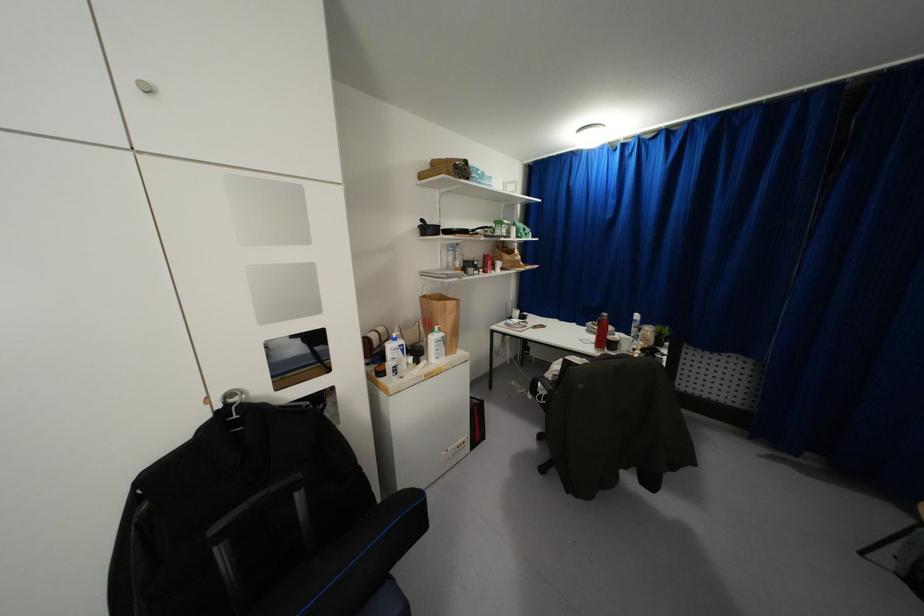
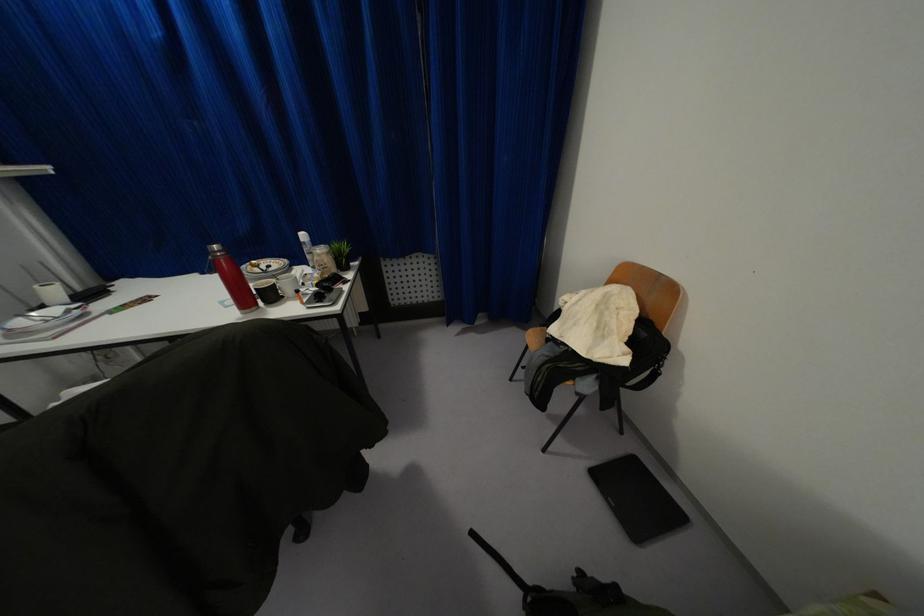
Find the pixel in the second image that matches [603,314] in the first image.

(214, 246)